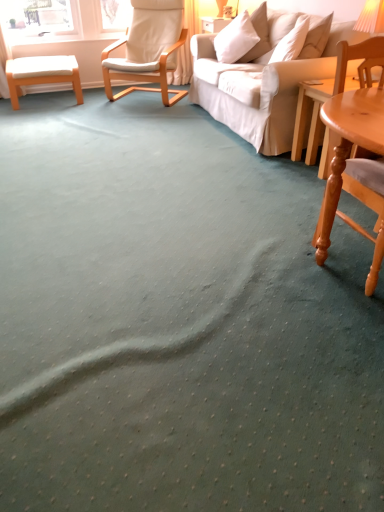
Question: From a real-world perspective, does orange fabric lampshade at upper right stand above white fabric chair at upper left, the second chair positioned from the right?

Choices:
 (A) yes
 (B) no

Answer: (A)

Question: Is orange fabric lampshade at upper right directly adjacent to white fabric chair at upper left, which ranks as the 2th chair in front-to-back order?

Choices:
 (A) yes
 (B) no

Answer: (B)

Question: Does orange fabric lampshade at upper right have a greater width compared to white fabric chair at upper left, which appears as the first chair when viewed from the top?

Choices:
 (A) no
 (B) yes

Answer: (A)

Question: Would you say white fabric chair at upper left, placed as the 2th chair when sorted from bottom to top, is part of orange fabric lampshade at upper right's contents?

Choices:
 (A) yes
 (B) no

Answer: (B)

Question: Does orange fabric lampshade at upper right appear on the left side of white fabric chair at upper left, the first chair from the left?

Choices:
 (A) no
 (B) yes

Answer: (A)

Question: From the image's perspective, would you say orange fabric lampshade at upper right is shown under white fabric chair at upper left, placed as the 2th chair when sorted from bottom to top?

Choices:
 (A) yes
 (B) no

Answer: (A)

Question: Considering the relative sizes of white soft pillow at upper right and white fabric chair at upper left, which appears as the first chair when viewed from the top, in the image provided, is white soft pillow at upper right taller than white fabric chair at upper left, which appears as the first chair when viewed from the top,?

Choices:
 (A) no
 (B) yes

Answer: (A)

Question: Is white soft pillow at upper right at the right side of white fabric chair at upper left, placed as the 2th chair when sorted from bottom to top?

Choices:
 (A) yes
 (B) no

Answer: (A)

Question: From a real-world perspective, does white soft pillow at upper right stand above white fabric chair at upper left, the first chair from the left?

Choices:
 (A) no
 (B) yes

Answer: (B)

Question: Would you say white fabric chair at upper left, the first chair from the left, is part of white soft pillow at upper right's contents?

Choices:
 (A) yes
 (B) no

Answer: (B)

Question: Is white soft pillow at upper right further to camera compared to white fabric chair at upper left, placed as the 2th chair when sorted from bottom to top?

Choices:
 (A) no
 (B) yes

Answer: (A)

Question: Does white soft pillow at upper right have a smaller size compared to white fabric chair at upper left, placed as the 1th chair when sorted from back to front?

Choices:
 (A) yes
 (B) no

Answer: (A)

Question: Does orange wood stool at left turn towards light brown wooden coffee table at right?

Choices:
 (A) no
 (B) yes

Answer: (A)